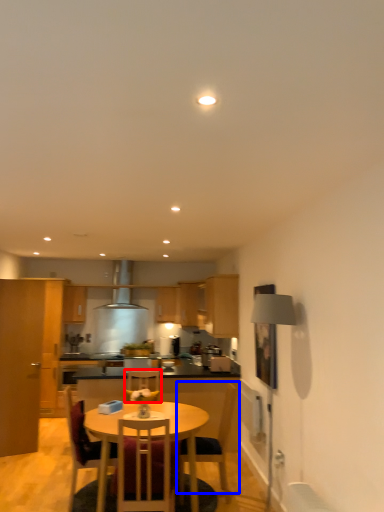
Question: Which point is closer to the camera, chair (highlighted by a red box) or chair (highlighted by a blue box)?

Choices:
 (A) chair
 (B) chair

Answer: (B)